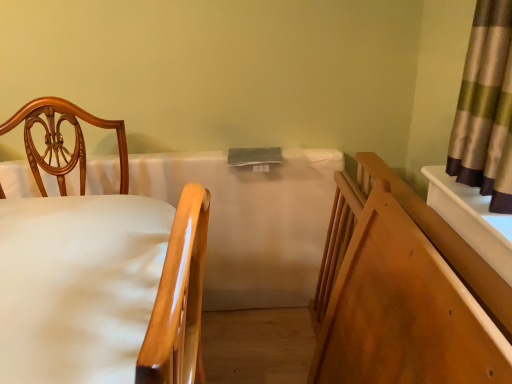
Question: Is wooden chair at left inside or outside of wooden bed frame at right?

Choices:
 (A) outside
 (B) inside

Answer: (A)

Question: Considering the positions of point (167, 269) and point (500, 291), is point (167, 269) closer or farther from the camera than point (500, 291)?

Choices:
 (A) closer
 (B) farther

Answer: (A)

Question: Estimate the real-world distances between objects in this image. Which object is farther from the wooden bed frame at right?

Choices:
 (A) white fabric mattress at center
 (B) wooden chair at left

Answer: (B)

Question: Which object is positioned closest to the wooden bed frame at right?

Choices:
 (A) white fabric mattress at center
 (B) wooden chair at left

Answer: (A)